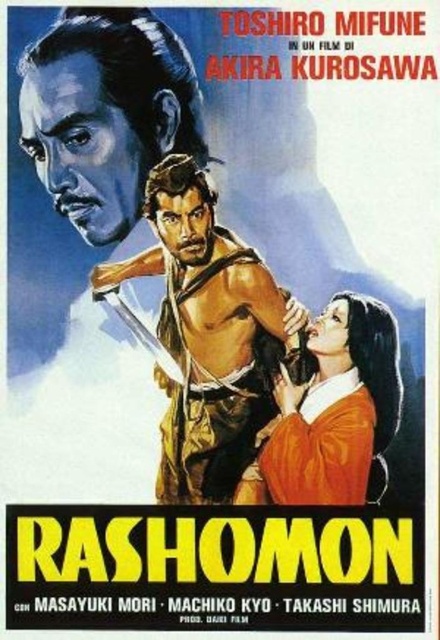
Looking at the movie poster for Rashomon, you notice the matte black face at upper left and the smooth orange kimono at lower right. Which object is positioned higher in the image?

The matte black face at upper left is positioned higher than the smooth orange kimono at lower right.

You are an art critic analyzing the spatial relationships in the movie poster for Rashomon. You notice two points on the poster at coordinates point (216, 432) and point (341, 424). Which point is closer to the viewer?

Point (216, 432) is further to the viewer than point (341, 424), so point (216, 432) is closer to the viewer.